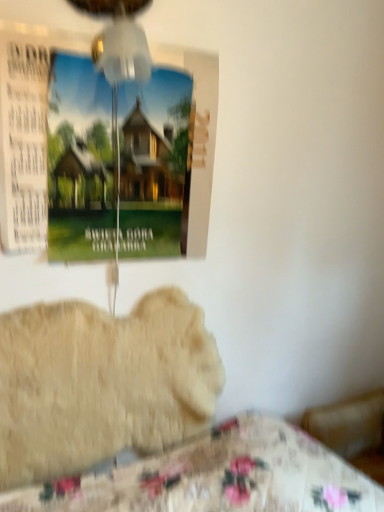
Where is `matte paper poster at upper left`? matte paper poster at upper left is located at coordinates (80, 162).

Find the location of a particular element. The width and height of the screenshot is (384, 512). fluffy beige dog at lower left is located at coordinates (101, 383).

Describe the element at coordinates (101, 383) in the screenshot. I see `fluffy beige dog at lower left` at that location.

This screenshot has width=384, height=512. Identify the location of transparent plastic mechanical fan at upper center. (119, 40).

Looking at this image, from the image's perspective, which one is positioned higher, fluffy beige dog at lower left or transparent plastic mechanical fan at upper center?

transparent plastic mechanical fan at upper center is shown above in the image.

Would you say fluffy beige dog at lower left contains transparent plastic mechanical fan at upper center?

No.

From a real-world perspective, does fluffy beige dog at lower left stand above transparent plastic mechanical fan at upper center?

No.

Which is further, (144, 347) or (95, 0)?

The point (144, 347) is farther.

Is transparent plastic mechanical fan at upper center inside or outside of matte paper poster at upper left?

transparent plastic mechanical fan at upper center is located beyond the bounds of matte paper poster at upper left.

Is point (112, 12) in front of point (179, 78)?

Yes, point (112, 12) is in front of point (179, 78).

Can you confirm if transparent plastic mechanical fan at upper center is wider than matte paper poster at upper left?

Yes, transparent plastic mechanical fan at upper center is wider than matte paper poster at upper left.

From a real-world perspective, is transparent plastic mechanical fan at upper center under matte paper poster at upper left?

No.

Between matte paper poster at upper left and transparent plastic mechanical fan at upper center, which one has smaller width?

matte paper poster at upper left is thinner.

The image size is (384, 512). In order to click on poster page on the left of transparent plastic mechanical fan at upper center in this screenshot , I will do `click(80, 162)`.

Would you consider matte paper poster at upper left to be distant from transparent plastic mechanical fan at upper center?

matte paper poster at upper left is actually quite close to transparent plastic mechanical fan at upper center.

Based on the photo, do you think matte paper poster at upper left is within transparent plastic mechanical fan at upper center, or outside of it?

matte paper poster at upper left is spatially situated outside transparent plastic mechanical fan at upper center.

Which object is wider, matte paper poster at upper left or fluffy beige dog at lower left?

Wider between the two is matte paper poster at upper left.

Is matte paper poster at upper left with fluffy beige dog at lower left?

They are not placed beside each other.

Which of these two, matte paper poster at upper left or fluffy beige dog at lower left, is smaller?

matte paper poster at upper left is smaller.

Is matte paper poster at upper left positioned with its back to fluffy beige dog at lower left?

matte paper poster at upper left does not have its back to fluffy beige dog at lower left.

Is the depth of transparent plastic mechanical fan at upper center greater than that of fluffy beige dog at lower left?

No, it is not.

Is transparent plastic mechanical fan at upper center directly adjacent to fluffy beige dog at lower left?

No.

Can you confirm if transparent plastic mechanical fan at upper center is smaller than fluffy beige dog at lower left?

Yes, transparent plastic mechanical fan at upper center is smaller than fluffy beige dog at lower left.

Is fluffy beige dog at lower left beside matte paper poster at upper left?

No.

Considering the relative sizes of fluffy beige dog at lower left and matte paper poster at upper left in the image provided, is fluffy beige dog at lower left shorter than matte paper poster at upper left?

Yes, fluffy beige dog at lower left is shorter than matte paper poster at upper left.

Looking at this image, considering the sizes of objects fluffy beige dog at lower left and matte paper poster at upper left in the image provided, who is thinner, fluffy beige dog at lower left or matte paper poster at upper left?

Thinner between the two is fluffy beige dog at lower left.

Is matte paper poster at upper left surrounded by fluffy beige dog at lower left?

No, matte paper poster at upper left is not a part of fluffy beige dog at lower left.

Image resolution: width=384 pixels, height=512 pixels. There is a fluffy beige dog at lower left. What are the coordinates of `mechanical fan above it (from a real-world perspective)` in the screenshot? It's located at (119, 40).

Locate an element on the screen. The width and height of the screenshot is (384, 512). mechanical fan that is on the right side of matte paper poster at upper left is located at coordinates click(x=119, y=40).

Estimate the real-world distances between objects in this image. Which object is closer to transparent plastic mechanical fan at upper center, fluffy beige dog at lower left or matte paper poster at upper left?

Among the two, matte paper poster at upper left is located nearer to transparent plastic mechanical fan at upper center.

Which object lies nearer to the anchor point matte paper poster at upper left, fluffy beige dog at lower left or transparent plastic mechanical fan at upper center?

Based on the image, transparent plastic mechanical fan at upper center appears to be nearer to matte paper poster at upper left.

When comparing their distances from matte paper poster at upper left, does transparent plastic mechanical fan at upper center or fluffy beige dog at lower left seem closer?

transparent plastic mechanical fan at upper center.

Based on the photo, based on their spatial positions, is matte paper poster at upper left or transparent plastic mechanical fan at upper center closer to fluffy beige dog at lower left?

matte paper poster at upper left lies closer to fluffy beige dog at lower left than the other object.

When comparing their distances from transparent plastic mechanical fan at upper center, does matte paper poster at upper left or fluffy beige dog at lower left seem further?

The object further to transparent plastic mechanical fan at upper center is fluffy beige dog at lower left.

From the image, which object appears to be nearer to fluffy beige dog at lower left, transparent plastic mechanical fan at upper center or matte paper poster at upper left?

matte paper poster at upper left.

At what (x,y) coordinates should I click in order to perform the action: click on poster page between transparent plastic mechanical fan at upper center and fluffy beige dog at lower left from top to bottom. Please return your answer as a coordinate pair (x, y). Looking at the image, I should click on (80, 162).